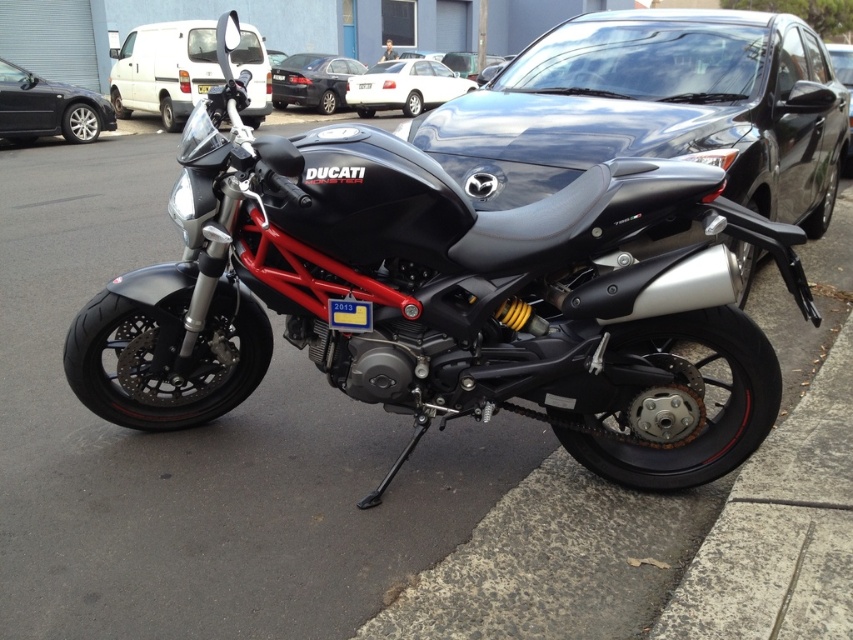
Question: Which is nearer to the white glossy sedan at center?

Choices:
 (A) white matte van at upper left
 (B) glossy black car at center
 (C) matte black motorcycle at center

Answer: (A)

Question: Does black metallic sedan at left have a greater width compared to silver metallic sedan at center?

Choices:
 (A) no
 (B) yes

Answer: (A)

Question: Is matte black motorcycle at center smaller than black metallic sedan at left?

Choices:
 (A) yes
 (B) no

Answer: (B)

Question: Does black metallic sedan at left have a lesser width compared to silver metallic sedan at center?

Choices:
 (A) no
 (B) yes

Answer: (B)

Question: Estimate the real-world distances between objects in this image. Which object is closer to the glossy black car at center?

Choices:
 (A) white matte van at upper left
 (B) black metallic sedan at left

Answer: (B)

Question: Which object appears farthest from the camera in this image?

Choices:
 (A) white matte van at upper left
 (B) yellow plastic license plate at center
 (C) white glossy sedan at center

Answer: (C)